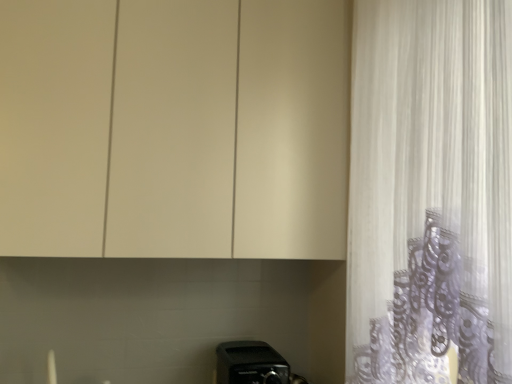
Question: Is black plastic toaster at lower center aimed at matte white cabinet at upper center?

Choices:
 (A) yes
 (B) no

Answer: (B)

Question: Is matte white cabinet at upper center surrounded by black plastic toaster at lower center?

Choices:
 (A) yes
 (B) no

Answer: (B)

Question: Is black plastic toaster at lower center to the right of matte white cabinet at upper center from the viewer's perspective?

Choices:
 (A) no
 (B) yes

Answer: (B)

Question: From a real-world perspective, is black plastic toaster at lower center beneath matte white cabinet at upper center?

Choices:
 (A) yes
 (B) no

Answer: (A)

Question: Is black plastic toaster at lower center at the left side of matte white cabinet at upper center?

Choices:
 (A) no
 (B) yes

Answer: (A)

Question: Looking at their shapes, would you say black plastic toaster at lower center is wider or thinner than matte white cabinet at upper center?

Choices:
 (A) thin
 (B) wide

Answer: (B)

Question: Considering the positions of point (254, 375) and point (305, 162), is point (254, 375) closer or farther from the camera than point (305, 162)?

Choices:
 (A) farther
 (B) closer

Answer: (A)

Question: From the image's perspective, is black plastic toaster at lower center located above or below matte white cabinet at upper center?

Choices:
 (A) below
 (B) above

Answer: (A)

Question: Is black plastic toaster at lower center spatially inside matte white cabinet at upper center, or outside of it?

Choices:
 (A) inside
 (B) outside

Answer: (B)

Question: In terms of size, does black plastic toaster at lower center appear bigger or smaller than white sheer curtain at right?

Choices:
 (A) big
 (B) small

Answer: (B)

Question: From a real-world perspective, is black plastic toaster at lower center physically located above or below white sheer curtain at right?

Choices:
 (A) above
 (B) below

Answer: (B)

Question: Relative to white sheer curtain at right, is black plastic toaster at lower center in front or behind?

Choices:
 (A) front
 (B) behind

Answer: (B)

Question: Considering the positions of black plastic toaster at lower center and white sheer curtain at right in the image, is black plastic toaster at lower center taller or shorter than white sheer curtain at right?

Choices:
 (A) tall
 (B) short

Answer: (B)

Question: From the image's perspective, is matte white cabinet at upper center located above or below white sheer curtain at right?

Choices:
 (A) below
 (B) above

Answer: (B)

Question: Considering the positions of matte white cabinet at upper center and white sheer curtain at right in the image, is matte white cabinet at upper center taller or shorter than white sheer curtain at right?

Choices:
 (A) short
 (B) tall

Answer: (A)